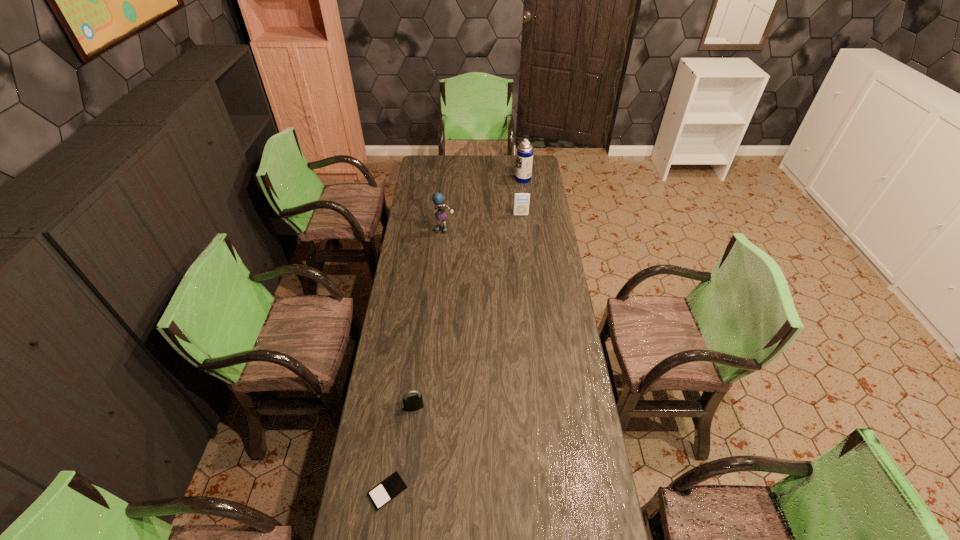
What are the coordinates of `iPod that is at the right edge` in the screenshot? It's located at (521, 199).

The image size is (960, 540). In order to click on object that is at the far right corner in this screenshot , I will do `click(524, 160)`.

Find the location of a particular element. vacant space at the far edge is located at coordinates (453, 169).

Locate an element on the screen. vacant area at the left edge is located at coordinates (423, 255).

The height and width of the screenshot is (540, 960). I want to click on vacant area at the right edge, so click(x=546, y=399).

Identify the location of vacant space that's between the third nearest object and the padlock. The width and height of the screenshot is (960, 540). (429, 319).

Locate an element on the screen. The image size is (960, 540). vacant space in between the second farthest object and the third nearest object is located at coordinates (483, 222).

The width and height of the screenshot is (960, 540). Identify the location of vacant space that is in between the nearer iPod and the fourth farthest object. (401, 449).

Locate an element on the screen. This screenshot has width=960, height=540. vacant area between the nearer iPod and the rag doll is located at coordinates (416, 361).

This screenshot has width=960, height=540. In order to click on free space between the rag doll and the shortest object in this screenshot , I will do `click(416, 361)`.